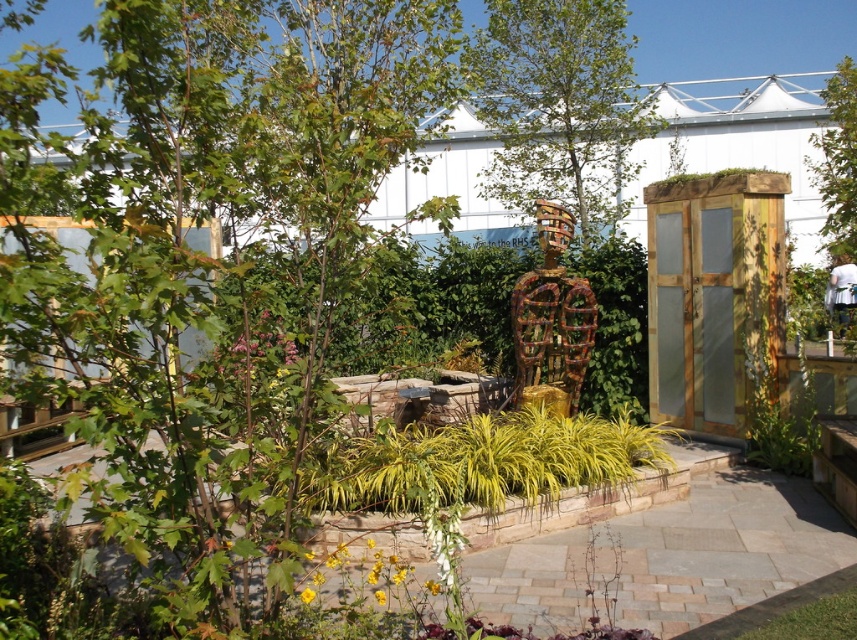
Who is taller, green leafy tree at upper center or green leafy tree at upper right?

green leafy tree at upper right

Is green leafy tree at upper center in front of green leafy tree at upper right?

No, it is not.

Describe the element at coordinates (559, 106) in the screenshot. The width and height of the screenshot is (857, 640). I see `green leafy tree at upper center` at that location.

The image size is (857, 640). Find the location of `green leafy tree at upper center`. green leafy tree at upper center is located at coordinates (559, 106).